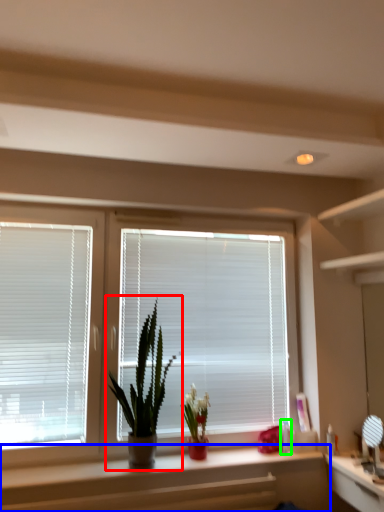
Question: Which object is positioned farthest from houseplant (highlighted by a red box)? Select from counter (highlighted by a blue box) and toiletry (highlighted by a green box).

Choices:
 (A) counter
 (B) toiletry

Answer: (B)